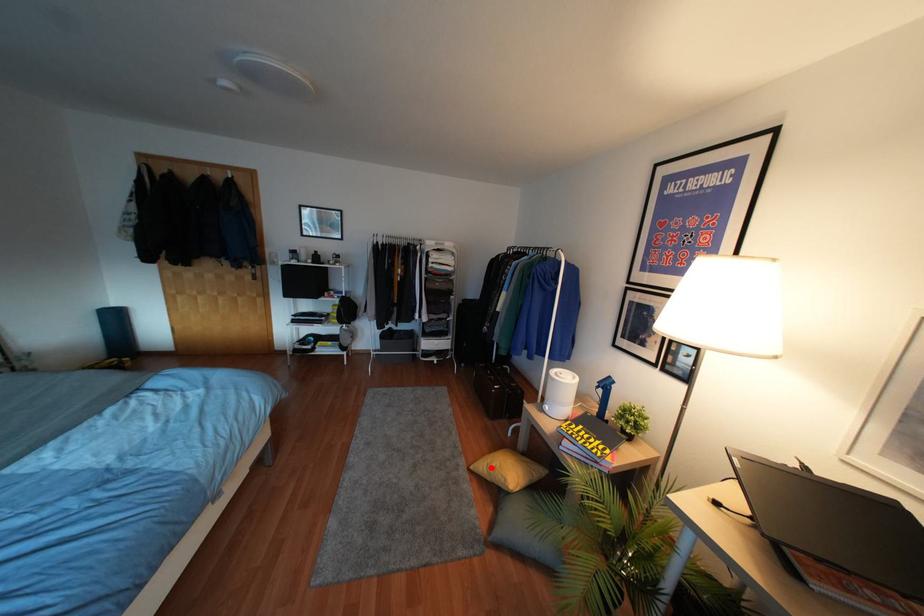
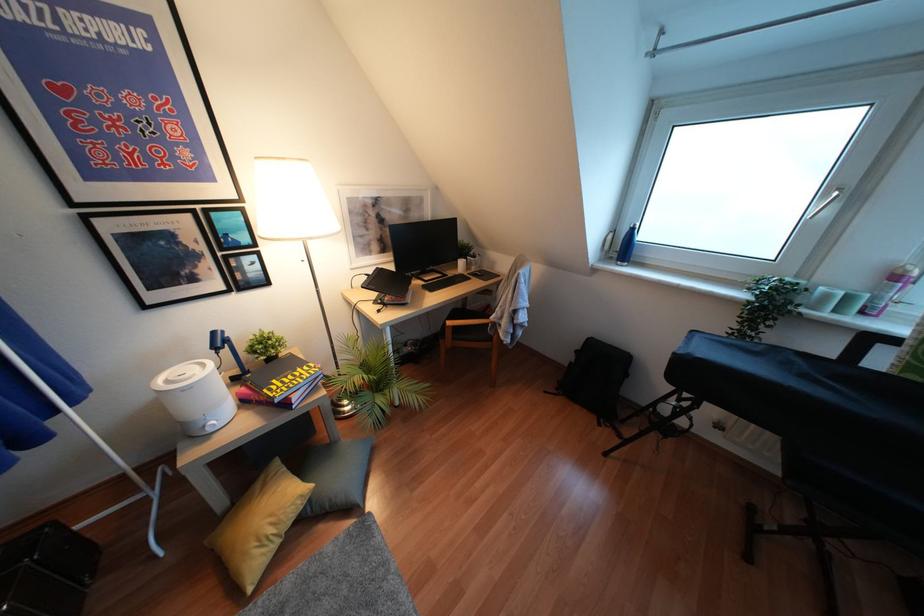
Question: I am providing you with two images of the same scene from different viewpoints. Given a red point in image1, look at the same physical point in image2. Is it:

Choices:
 (A) Closer to the viewpoint
 (B) Farther from the viewpoint

Answer: (B)